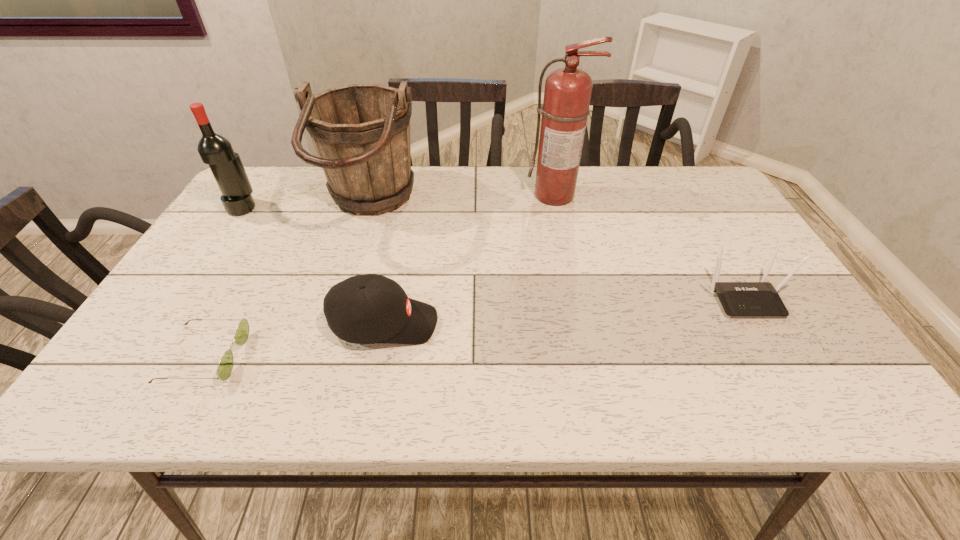
I want to click on object at the right edge, so click(x=739, y=299).

Where is `object at the far left corner`? object at the far left corner is located at coordinates (215, 150).

I want to click on object that is positioned at the near left corner, so click(225, 367).

At what (x,y) coordinates should I click in order to perform the action: click on vacant space at the far edge of the desktop. Please return your answer as a coordinate pair (x, y). Image resolution: width=960 pixels, height=540 pixels. Looking at the image, I should click on (609, 170).

In the image, there is a desktop. Identify the location of vacant space at the near edge. click(233, 402).

Identify the location of free space at the left edge. This screenshot has width=960, height=540. (219, 235).

Identify the location of vacant space at the right edge of the desktop. This screenshot has height=540, width=960. (744, 254).

At what (x,y) coordinates should I click in order to perform the action: click on free point at the far right corner. Please return your answer as a coordinate pair (x, y). Looking at the image, I should click on (687, 205).

Identify the location of free space between the rightmost object and the leftmost object. This screenshot has width=960, height=540. (493, 252).

Locate an element on the screen. This screenshot has height=540, width=960. vacant area between the tallest object and the bucket is located at coordinates (462, 201).